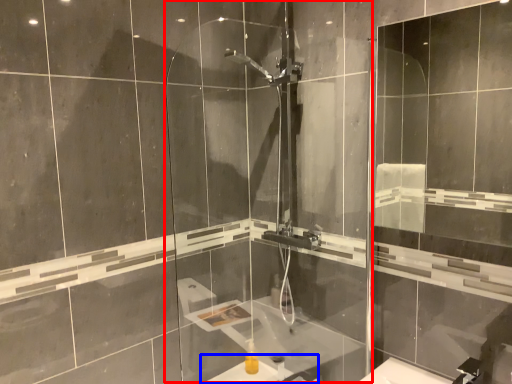
Question: Which point is further to the camera, screen door (highlighted by a red box) or sink (highlighted by a blue box)?

Choices:
 (A) screen door
 (B) sink

Answer: (B)